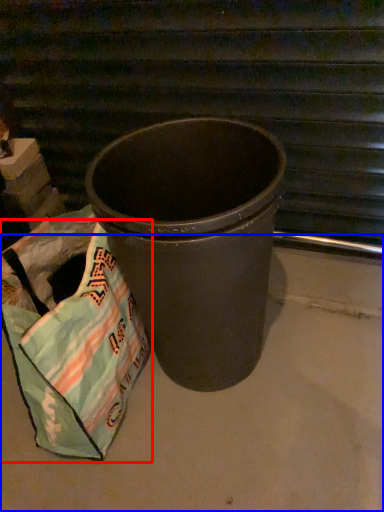
Question: Among these objects, which one is nearest to the camera, grocery bag (highlighted by a red box) or concrete (highlighted by a blue box)?

Choices:
 (A) grocery bag
 (B) concrete

Answer: (B)